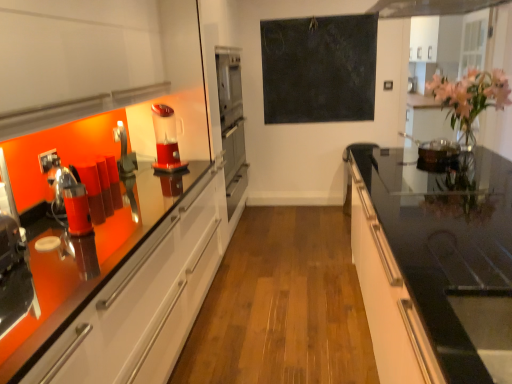
What do you see at coordinates (166, 139) in the screenshot? I see `red plastic blender at center, the 1th coffee machine positioned from the back` at bounding box center [166, 139].

What do you see at coordinates (124, 153) in the screenshot? The width and height of the screenshot is (512, 384). I see `metallic silver blender at left` at bounding box center [124, 153].

The width and height of the screenshot is (512, 384). I want to click on metallic silver blender at left, so click(x=124, y=153).

The image size is (512, 384). What do you see at coordinates (67, 195) in the screenshot?
I see `matte black coffee machine at left, positioned as the first coffee machine in front-to-back order` at bounding box center [67, 195].

Where is `pink glossy vase at upper right`? pink glossy vase at upper right is located at coordinates [x=471, y=96].

What is the approximate height of satin silver oven at center?

It is 28.16 inches.

The height and width of the screenshot is (384, 512). I want to click on red plastic blender at center, positioned as the second coffee machine in bottom-to-top order, so click(166, 139).

Consider the image. From a real-world perspective, is dark matte chalkboard at center physically below matte black coffee machine at left, which ranks as the 2th coffee machine in back-to-front order?

No, from a real-world perspective, dark matte chalkboard at center is not below matte black coffee machine at left, which ranks as the 2th coffee machine in back-to-front order.

Considering the relative sizes of dark matte chalkboard at center and matte black coffee machine at left, the 1th coffee machine in the left-to-right sequence, in the image provided, is dark matte chalkboard at center taller than matte black coffee machine at left, the 1th coffee machine in the left-to-right sequence,?

Yes, dark matte chalkboard at center is taller than matte black coffee machine at left, the 1th coffee machine in the left-to-right sequence.

Could you measure the distance between dark matte chalkboard at center and matte black coffee machine at left, the 1th coffee machine when ordered from bottom to top?

They are 9.15 feet apart.

Are dark matte chalkboard at center and matte black coffee machine at left, arranged as the 2th coffee machine when viewed from the right, far apart?

dark matte chalkboard at center is positioned a significant distance from matte black coffee machine at left, arranged as the 2th coffee machine when viewed from the right.

What are the coordinates of `oven above the matte black coffee machine at left, positioned as the first coffee machine in front-to-back order (from the image's perspective)` in the screenshot? It's located at (234, 165).

Is satin silver oven at center aimed at matte black coffee machine at left, positioned as the first coffee machine in front-to-back order?

No.

From a real-world perspective, is satin silver oven at center above or below matte black coffee machine at left, positioned as the first coffee machine in front-to-back order?

In terms of real-world spatial position, satin silver oven at center is below matte black coffee machine at left, positioned as the first coffee machine in front-to-back order.

Does satin silver oven at center come in front of matte black coffee machine at left, the 2th coffee machine positioned from the top?

No.

Is red plastic blender at center, the 1th coffee machine positioned from the back, inside or outside of dark matte chalkboard at center?

red plastic blender at center, the 1th coffee machine positioned from the back, is not inside dark matte chalkboard at center, it's outside.

Is point (172, 111) behind point (264, 118)?

No.

Is red plastic blender at center, placed as the second coffee machine when sorted from front to back, next to dark matte chalkboard at center and touching it?

red plastic blender at center, placed as the second coffee machine when sorted from front to back, and dark matte chalkboard at center are clearly separated.

Visually, is red plastic blender at center, the 1th coffee machine positioned from the back, positioned to the left or to the right of metallic silver blender at left?

Clearly, red plastic blender at center, the 1th coffee machine positioned from the back, is on the right of metallic silver blender at left in the image.

Is red plastic blender at center, positioned as the second coffee machine in bottom-to-top order, next to metallic silver blender at left and touching it?

No, red plastic blender at center, positioned as the second coffee machine in bottom-to-top order, is not beside metallic silver blender at left.

Is red plastic blender at center, positioned as the second coffee machine in bottom-to-top order, thinner than metallic silver blender at left?

Incorrect, the width of red plastic blender at center, positioned as the second coffee machine in bottom-to-top order, is not less than that of metallic silver blender at left.

Is point (131, 155) positioned before point (74, 233)?

No, it is not.

Relative to matte black coffee machine at left, the 2th coffee machine positioned from the top, is metallic silver blender at left in front or behind?

Visually, metallic silver blender at left is located behind matte black coffee machine at left, the 2th coffee machine positioned from the top.

Is metallic silver blender at left beside matte black coffee machine at left, positioned as the first coffee machine in front-to-back order?

No, metallic silver blender at left is not in contact with matte black coffee machine at left, positioned as the first coffee machine in front-to-back order.

Is metallic silver blender at left not inside matte black coffee machine at left, the 2th coffee machine positioned from the top?

Yes, metallic silver blender at left is located beyond the bounds of matte black coffee machine at left, the 2th coffee machine positioned from the top.

From the image's perspective, relative to red plastic blender at center, positioned as the second coffee machine in bottom-to-top order, is black glass countertop at right above or below?

→ Based on their image positions, black glass countertop at right is located beneath red plastic blender at center, positioned as the second coffee machine in bottom-to-top order.

Considering the relative sizes of black glass countertop at right and red plastic blender at center, the 1th coffee machine positioned from the back, in the image provided, is black glass countertop at right taller than red plastic blender at center, the 1th coffee machine positioned from the back,?

Yes.

Is black glass countertop at right facing away from red plastic blender at center, arranged as the second coffee machine when viewed from the left?

black glass countertop at right does not have its back to red plastic blender at center, arranged as the second coffee machine when viewed from the left.

Considering the relative sizes of black glass countertop at right and metallic silver blender at left in the image provided, is black glass countertop at right smaller than metallic silver blender at left?

No, black glass countertop at right is not smaller than metallic silver blender at left.

Considering the sizes of objects black glass countertop at right and metallic silver blender at left in the image provided, who is wider, black glass countertop at right or metallic silver blender at left?

Wider between the two is black glass countertop at right.

Is black glass countertop at right oriented towards metallic silver blender at left?

Yes, black glass countertop at right is facing metallic silver blender at left.

Is black glass countertop at right placed right next to metallic silver blender at left?

black glass countertop at right and metallic silver blender at left are not in contact.

At what (x,y) coordinates should I click in order to perform the action: click on bulletin board that is behind the matte black coffee machine at left, the 1th coffee machine in the left-to-right sequence. Please return your answer as a coordinate pair (x, y). The width and height of the screenshot is (512, 384). Looking at the image, I should click on (319, 69).

You are a GUI agent. You are given a task and a screenshot of the screen. Output one action in this format:
    pyautogui.click(x=<x>, y=<y>)
    Task: Click on the 2nd coffee machine in front of the satin silver oven at center, counting from the anchor's position
    The width and height of the screenshot is (512, 384).
    Given the screenshot: What is the action you would take?
    pyautogui.click(x=67, y=195)

When comparing their distances from red plastic blender at center, the 1th coffee machine positioned from the right, does black glass countertop at right or metallic silver blender at left seem closer?

metallic silver blender at left.

Which object lies nearer to the anchor point satin silver oven at center, black glass countertop at right or pink glossy vase at upper right?

black glass countertop at right is positioned closer to the anchor satin silver oven at center.

Looking at the image, which one is located further to red plastic blender at center, the 1th coffee machine positioned from the right, satin silver oven at center or matte black coffee machine at left, which ranks as the 2th coffee machine in back-to-front order?

satin silver oven at center is positioned further to the anchor red plastic blender at center, the 1th coffee machine positioned from the right.

Considering their positions, is dark matte chalkboard at center positioned further to matte black coffee machine at left, arranged as the 2th coffee machine when viewed from the right, than metallic silver blender at left?

Based on the image, dark matte chalkboard at center appears to be further to matte black coffee machine at left, arranged as the 2th coffee machine when viewed from the right.

When comparing their distances from black glass countertop at right, does pink glossy vase at upper right or satin silver oven at center seem further?

The object further to black glass countertop at right is satin silver oven at center.

From the picture: Looking at the image, which one is located closer to dark matte chalkboard at center, red plastic blender at center, positioned as the second coffee machine in bottom-to-top order, or black glass countertop at right?

The object closer to dark matte chalkboard at center is black glass countertop at right.

Looking at the image, which one is located closer to matte black coffee machine at left, the 1th coffee machine in the left-to-right sequence, red plastic blender at center, acting as the first coffee machine starting from the top, or black glass countertop at right?

Among the two, red plastic blender at center, acting as the first coffee machine starting from the top, is located nearer to matte black coffee machine at left, the 1th coffee machine in the left-to-right sequence.

Based on their spatial positions, is satin silver oven at center or dark matte chalkboard at center closer to red plastic blender at center, positioned as the second coffee machine in bottom-to-top order?

satin silver oven at center lies closer to red plastic blender at center, positioned as the second coffee machine in bottom-to-top order, than the other object.

This screenshot has width=512, height=384. In order to click on coffee machine between matte black coffee machine at left, the 1th coffee machine in the left-to-right sequence, and dark matte chalkboard at center from front to back in this screenshot , I will do `click(166, 139)`.

Find the location of `coffee machine situated between metallic silver blender at left and pink glossy vase at upper right from left to right`. coffee machine situated between metallic silver blender at left and pink glossy vase at upper right from left to right is located at coordinates (166, 139).

Locate an element on the screen. oven between matte black coffee machine at left, the 1th coffee machine in the left-to-right sequence, and pink glossy vase at upper right, in the horizontal direction is located at coordinates (234, 165).

In order to click on oven between pink glossy vase at upper right and dark matte chalkboard at center from front to back in this screenshot , I will do `click(234, 165)`.